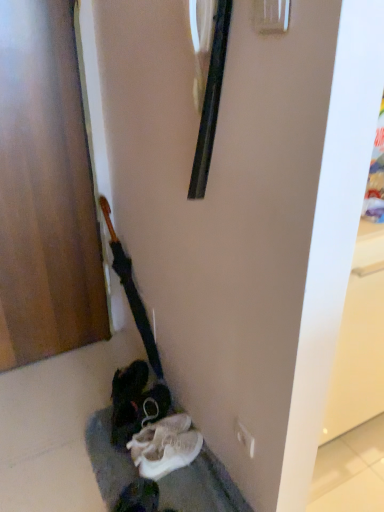
Question: Is wooden door at left aimed at white fabric shoe at lower center?

Choices:
 (A) yes
 (B) no

Answer: (A)

Question: Does wooden door at left appear on the right side of white fabric shoe at lower center?

Choices:
 (A) no
 (B) yes

Answer: (A)

Question: From a real-world perspective, does wooden door at left stand above white fabric shoe at lower center?

Choices:
 (A) no
 (B) yes

Answer: (B)

Question: From the image's perspective, is wooden door at left located beneath white fabric shoe at lower center?

Choices:
 (A) no
 (B) yes

Answer: (A)

Question: Is wooden door at left thinner than white fabric shoe at lower center?

Choices:
 (A) no
 (B) yes

Answer: (B)

Question: Is point (178, 414) closer or farther from the camera than point (74, 75)?

Choices:
 (A) closer
 (B) farther

Answer: (B)

Question: Looking at their shapes, would you say white fabric shoe at lower center is wider or thinner than wooden door at left?

Choices:
 (A) thin
 (B) wide

Answer: (B)

Question: From a real-world perspective, is white fabric shoe at lower center physically located above or below wooden door at left?

Choices:
 (A) below
 (B) above

Answer: (A)

Question: From the image's perspective, relative to wooden door at left, is white fabric shoe at lower center above or below?

Choices:
 (A) below
 (B) above

Answer: (A)

Question: Looking at the image, does white fabric shoe at lower center seem bigger or smaller compared to wooden polished guitar at left?

Choices:
 (A) small
 (B) big

Answer: (A)

Question: From the image's perspective, is white fabric shoe at lower center located above or below wooden polished guitar at left?

Choices:
 (A) below
 (B) above

Answer: (A)

Question: Is white fabric shoe at lower center taller or shorter than wooden polished guitar at left?

Choices:
 (A) tall
 (B) short

Answer: (B)

Question: From a real-world perspective, relative to wooden polished guitar at left, is white fabric shoe at lower center vertically above or below?

Choices:
 (A) below
 (B) above

Answer: (A)

Question: Is wooden polished guitar at left wider or thinner than wooden door at left?

Choices:
 (A) thin
 (B) wide

Answer: (B)

Question: Is wooden polished guitar at left bigger or smaller than wooden door at left?

Choices:
 (A) small
 (B) big

Answer: (A)